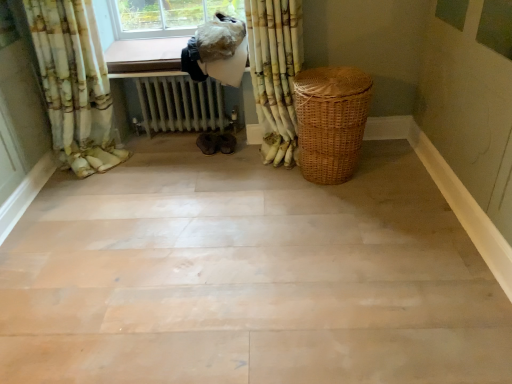
Question: Is woven brown basket at right spatially inside white metallic radiator at center, or outside of it?

Choices:
 (A) outside
 (B) inside

Answer: (A)

Question: From a real-world perspective, is woven brown basket at right positioned above or below white metallic radiator at center?

Choices:
 (A) below
 (B) above

Answer: (B)

Question: Based on their relative distances, which object is nearer to the floral fabric curtain at upper left, placed as the second curtain when sorted from right to left?

Choices:
 (A) wooden floor at center
 (B) woven brown basket at right
 (C) white metallic radiator at center
 (D) white textured curtain at upper right, the second curtain in the left-to-right sequence

Answer: (C)

Question: Estimate the real-world distances between objects in this image. Which object is farther from the floral fabric curtain at upper left, placed as the second curtain when sorted from right to left?

Choices:
 (A) wooden floor at center
 (B) white textured curtain at upper right, placed as the 1th curtain when sorted from right to left
 (C) woven brown basket at right
 (D) white metallic radiator at center

Answer: (C)